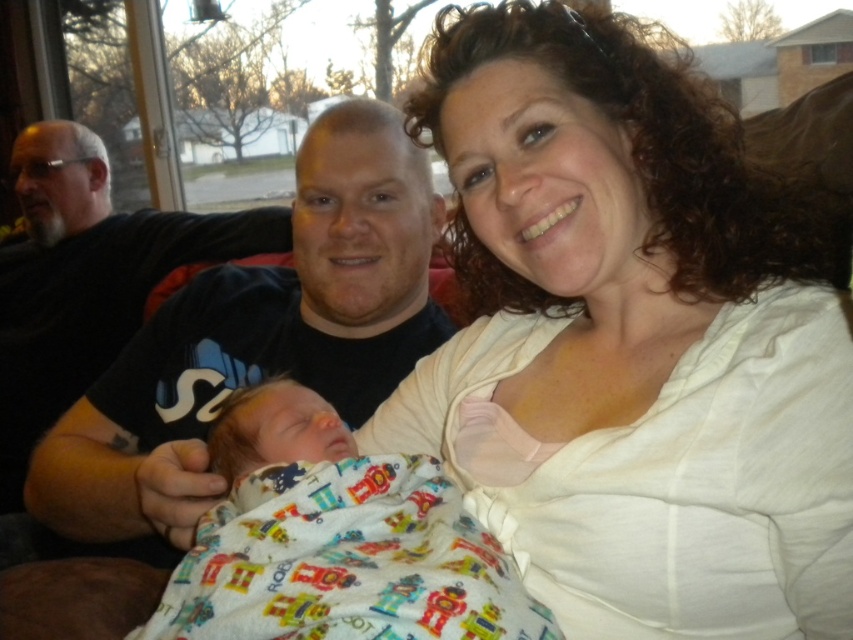
Is white soft shirt at upper right to the right of black cotton shirt at center from the viewer's perspective?

Yes, white soft shirt at upper right is to the right of black cotton shirt at center.

Is white soft shirt at upper right positioned in front of black cotton shirt at center?

That is True.

Is point (561, 99) positioned behind point (178, 392)?

No, it is in front of (178, 392).

What are the coordinates of `white soft shirt at upper right` in the screenshot? It's located at (630, 340).

Can you confirm if black cotton shirt at center is taller than soft white blanket at center?

Yes.

Which is behind, point (218, 339) or point (263, 456)?

The point (218, 339) is more distant.

Is point (114, 540) positioned behind point (453, 552)?

Yes, point (114, 540) is behind point (453, 552).

Where is `black cotton shirt at center`? This screenshot has width=853, height=640. black cotton shirt at center is located at coordinates (257, 339).

Does white soft shirt at upper right have a lesser width compared to soft white blanket at center?

In fact, white soft shirt at upper right might be wider than soft white blanket at center.

Between white soft shirt at upper right and soft white blanket at center, which one appears on the left side from the viewer's perspective?

From the viewer's perspective, soft white blanket at center appears more on the left side.

Does point (698, 182) lie behind point (358, 460)?

Yes.

I want to click on white soft shirt at upper right, so click(x=630, y=340).